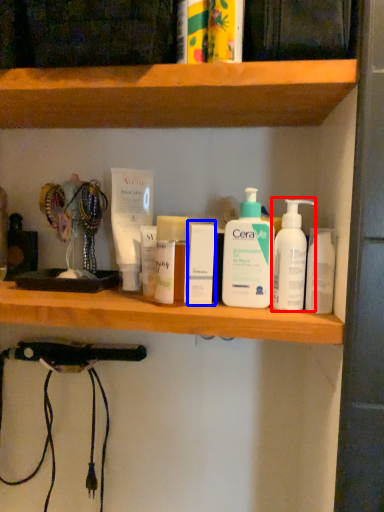
Question: Which point is closer to the camera, cleaning product (highlighted by a red box) or toiletry (highlighted by a blue box)?

Choices:
 (A) cleaning product
 (B) toiletry

Answer: (A)